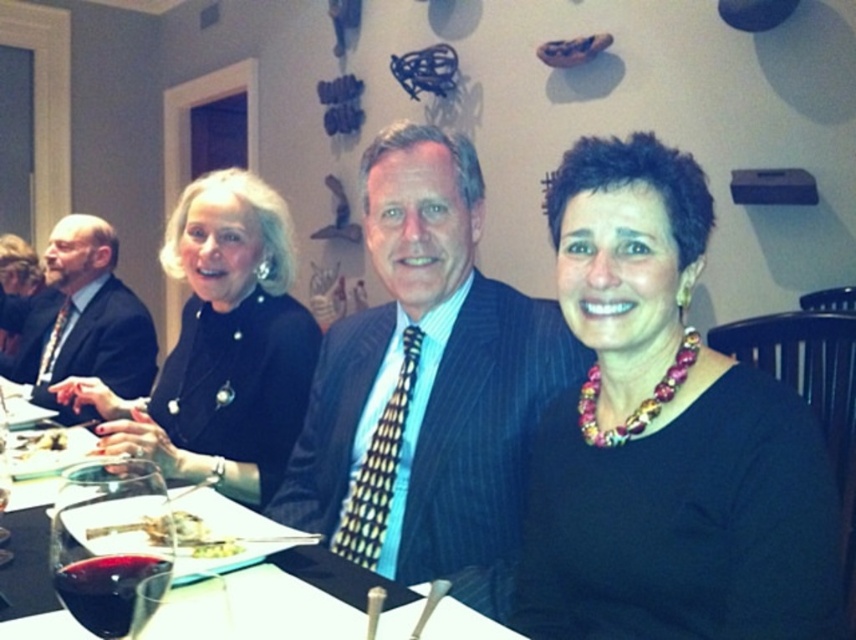
Question: Which point is closer to the camera?

Choices:
 (A) [x=87, y=572]
 (B) [x=544, y=413]
 (C) [x=186, y=532]

Answer: (A)

Question: Which point is closer to the camera?

Choices:
 (A) black silk dress at left
 (B) multicolored beaded necklace at center
 (C) white creamy food at lower left
 (D) translucent glass wine at lower left

Answer: (D)

Question: Where is pinstriped suit at center located in relation to black silk dress at left in the image?

Choices:
 (A) below
 (B) above

Answer: (A)

Question: Among these points, which one is nearest to the camera?

Choices:
 (A) (79, 506)
 (B) (96, 372)
 (C) (40, 513)

Answer: (A)

Question: Does golden brown bread at center appear on the left side of white creamy food at lower left?

Choices:
 (A) no
 (B) yes

Answer: (A)

Question: Can you confirm if multicolored beaded necklace at center is bigger than pinstriped suit at center?

Choices:
 (A) no
 (B) yes

Answer: (A)